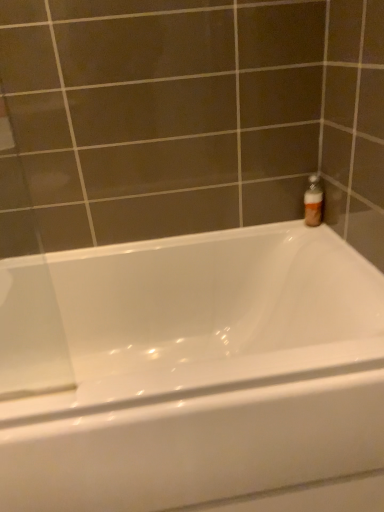
The width and height of the screenshot is (384, 512). What do you see at coordinates (313, 201) in the screenshot?
I see `translucent plastic bottle at upper right` at bounding box center [313, 201].

You are a GUI agent. You are given a task and a screenshot of the screen. Output one action in this format:
    pyautogui.click(x=<x>, y=<y>)
    Task: Click on the translucent plastic bottle at upper right
    Image resolution: width=384 pixels, height=512 pixels.
    Given the screenshot: What is the action you would take?
    pyautogui.click(x=313, y=201)

Measure the distance between translucent plastic bottle at upper right and camera.

translucent plastic bottle at upper right and camera are 4.35 feet apart.

Describe the element at coordinates (189, 370) in the screenshot. The height and width of the screenshot is (512, 384). I see `white glossy bathtub at upper right` at that location.

Where is `white glossy bathtub at upper right`? The height and width of the screenshot is (512, 384). white glossy bathtub at upper right is located at coordinates (189, 370).

Measure the distance between white glossy bathtub at upper right and camera.

white glossy bathtub at upper right is 77.26 centimeters away from camera.

Locate an element on the screen. This screenshot has height=512, width=384. translucent plastic bottle at upper right is located at coordinates (313, 201).

Is translucent plastic bottle at upper right to the left of white glossy bathtub at upper right from the viewer's perspective?

In fact, translucent plastic bottle at upper right is to the right of white glossy bathtub at upper right.

Considering the positions of objects translucent plastic bottle at upper right and white glossy bathtub at upper right in the image provided, who is in front, translucent plastic bottle at upper right or white glossy bathtub at upper right?

white glossy bathtub at upper right is more forward.

Is point (314, 188) farther from camera compared to point (28, 291)?

No.

From the image's perspective, between translucent plastic bottle at upper right and white glossy bathtub at upper right, which one is located above?

translucent plastic bottle at upper right is shown above in the image.

From a real-world perspective, is translucent plastic bottle at upper right physically located above or below white glossy bathtub at upper right?

From a real-world perspective, translucent plastic bottle at upper right is physically above white glossy bathtub at upper right.

Can you confirm if translucent plastic bottle at upper right is wider than white glossy bathtub at upper right?

Incorrect, the width of translucent plastic bottle at upper right does not surpass that of white glossy bathtub at upper right.

From their relative heights in the image, would you say translucent plastic bottle at upper right is taller or shorter than white glossy bathtub at upper right?

Clearly, translucent plastic bottle at upper right is shorter compared to white glossy bathtub at upper right.

Who is smaller, translucent plastic bottle at upper right or white glossy bathtub at upper right?

translucent plastic bottle at upper right.

Which is correct: translucent plastic bottle at upper right is inside white glossy bathtub at upper right, or outside of it?

translucent plastic bottle at upper right is located beyond the bounds of white glossy bathtub at upper right.

Are translucent plastic bottle at upper right and white glossy bathtub at upper right making contact?

translucent plastic bottle at upper right is not next to white glossy bathtub at upper right, and they're not touching.

Is translucent plastic bottle at upper right facing away from white glossy bathtub at upper right?

That's not correct — translucent plastic bottle at upper right is not looking away from white glossy bathtub at upper right.

What's the angular difference between translucent plastic bottle at upper right and white glossy bathtub at upper right's facing directions?

The angular difference between translucent plastic bottle at upper right and white glossy bathtub at upper right is 0.000324 degrees.

I want to click on bathtub located on the left of translucent plastic bottle at upper right, so click(x=189, y=370).

Is white glossy bathtub at upper right at the left side of translucent plastic bottle at upper right?

Correct, you'll find white glossy bathtub at upper right to the left of translucent plastic bottle at upper right.

Which object is closer to the camera taking this photo, white glossy bathtub at upper right or translucent plastic bottle at upper right?

white glossy bathtub at upper right is more forward.

Does point (153, 274) lie in front of point (306, 219)?

No.

From the image's perspective, is white glossy bathtub at upper right positioned above or below translucent plastic bottle at upper right?

From the image's perspective, white glossy bathtub at upper right appears below translucent plastic bottle at upper right.

From a real-world perspective, does white glossy bathtub at upper right stand above translucent plastic bottle at upper right?

No, from a real-world perspective, white glossy bathtub at upper right is not over translucent plastic bottle at upper right

Considering the relative sizes of white glossy bathtub at upper right and translucent plastic bottle at upper right in the image provided, is white glossy bathtub at upper right wider than translucent plastic bottle at upper right?

Yes, white glossy bathtub at upper right is wider than translucent plastic bottle at upper right.

In terms of height, does white glossy bathtub at upper right look taller or shorter compared to translucent plastic bottle at upper right?

Clearly, white glossy bathtub at upper right is taller compared to translucent plastic bottle at upper right.

Can you confirm if white glossy bathtub at upper right is bigger than translucent plastic bottle at upper right?

Yes, white glossy bathtub at upper right is bigger than translucent plastic bottle at upper right.

Is white glossy bathtub at upper right positioned beyond the bounds of translucent plastic bottle at upper right?

Yes, white glossy bathtub at upper right is outside of translucent plastic bottle at upper right.

Would you consider white glossy bathtub at upper right to be distant from translucent plastic bottle at upper right?

white glossy bathtub at upper right is near translucent plastic bottle at upper right, not far away.

Does white glossy bathtub at upper right turn towards translucent plastic bottle at upper right?

No, white glossy bathtub at upper right does not turn towards translucent plastic bottle at upper right.

How far apart are white glossy bathtub at upper right and translucent plastic bottle at upper right?

white glossy bathtub at upper right is 22.67 inches away from translucent plastic bottle at upper right.

Locate an element on the screen. The height and width of the screenshot is (512, 384). bathtub on the left of translucent plastic bottle at upper right is located at coordinates (189, 370).

In order to click on bathtub that is in front of the translucent plastic bottle at upper right in this screenshot , I will do `click(189, 370)`.

Image resolution: width=384 pixels, height=512 pixels. There is a white glossy bathtub at upper right. Find the location of `bottle above it (from a real-world perspective)`. bottle above it (from a real-world perspective) is located at coordinates click(313, 201).